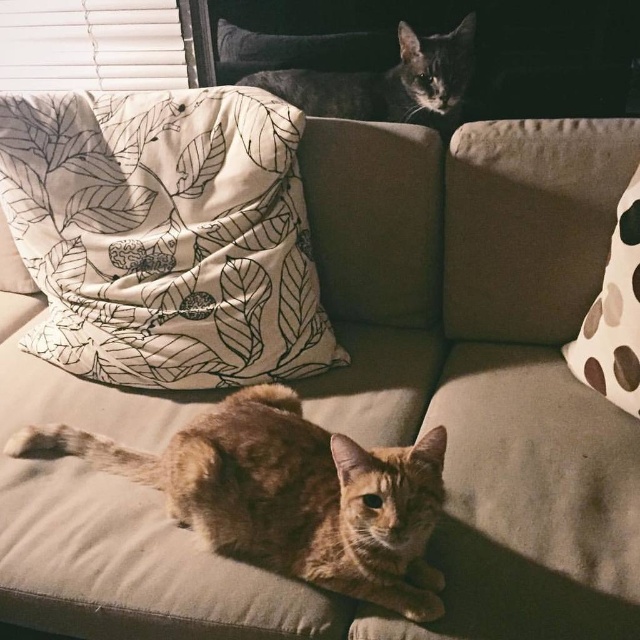
Question: Estimate the real-world distances between objects in this image. Which object is farther from the white fabric pillow with leaf pattern at upper left?

Choices:
 (A) orange tabby cat at center
 (B) white dotted pillow at right
 (C) gray fur cat at upper center

Answer: (B)

Question: Which point is closer to the camera?

Choices:
 (A) (198, 108)
 (B) (636, 205)
 (C) (253, 547)
 (D) (372, 104)

Answer: (C)

Question: Does gray fur cat at upper center appear on the right side of white dotted pillow at right?

Choices:
 (A) yes
 (B) no

Answer: (B)

Question: Estimate the real-world distances between objects in this image. Which object is farther from the gray fur cat at upper center?

Choices:
 (A) orange tabby cat at center
 (B) white dotted pillow at right

Answer: (A)

Question: In this image, where is white fabric pillow with leaf pattern at upper left located relative to orange tabby cat at center?

Choices:
 (A) right
 (B) left

Answer: (B)

Question: Does white fabric pillow with leaf pattern at upper left come in front of white dotted pillow at right?

Choices:
 (A) no
 (B) yes

Answer: (A)